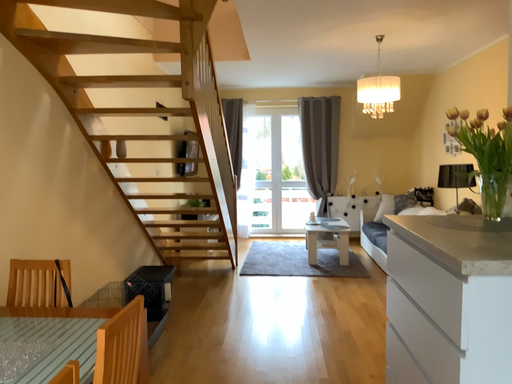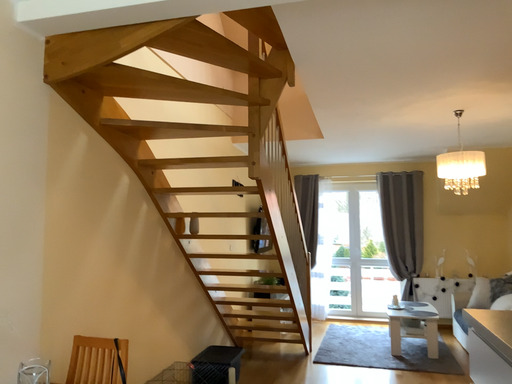
Question: Which way did the camera rotate in the video?

Choices:
 (A) rotated downward
 (B) rotated upward

Answer: (B)